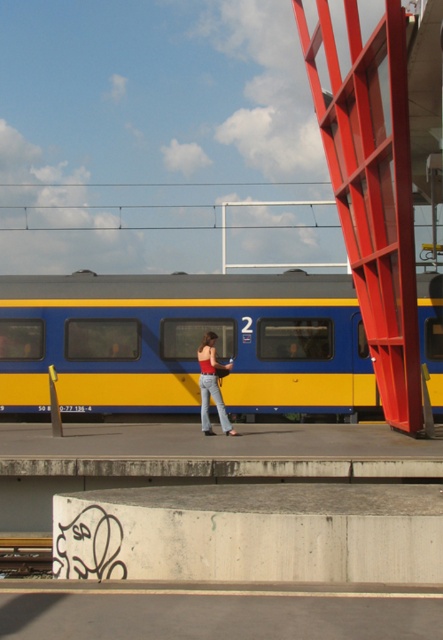
Question: Is blue/yellow painted train at center to the left of denim jeans at center from the viewer's perspective?

Choices:
 (A) no
 (B) yes

Answer: (B)

Question: Which object appears farthest from the camera in this image?

Choices:
 (A) denim jeans at center
 (B) blue/yellow painted train at center

Answer: (B)

Question: Can you confirm if blue/yellow painted train at center is thinner than denim jeans at center?

Choices:
 (A) no
 (B) yes

Answer: (A)

Question: Is blue/yellow painted train at center below denim jeans at center?

Choices:
 (A) no
 (B) yes

Answer: (A)

Question: Among these objects, which one is nearest to the camera?

Choices:
 (A) denim jeans at center
 (B) blue/yellow painted train at center

Answer: (A)